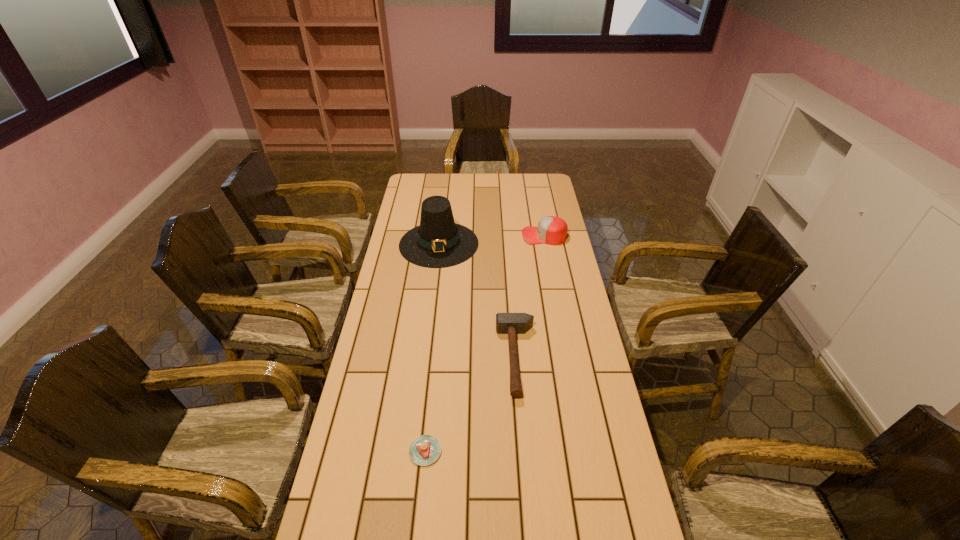
Identify the location of the tallest object. Image resolution: width=960 pixels, height=540 pixels. (438, 242).

Identify the location of baseball cap. The height and width of the screenshot is (540, 960). (552, 230).

At what (x,y) coordinates should I click in order to perform the action: click on the third farthest object. Please return your answer as a coordinate pair (x, y). This screenshot has height=540, width=960. Looking at the image, I should click on (506, 323).

This screenshot has width=960, height=540. Identify the location of the third tallest object. (506, 323).

You are a GUI agent. You are given a task and a screenshot of the screen. Output one action in this format:
    pyautogui.click(x=<x>, y=<y>)
    Task: Click on the shortest object
    Image resolution: width=960 pixels, height=540 pixels.
    Given the screenshot: What is the action you would take?
    pyautogui.click(x=424, y=450)

Identify the location of pastry. (424, 450).

Image resolution: width=960 pixels, height=540 pixels. In order to click on free space located 0.050m on the front-facing side of the tallest object in this screenshot , I will do `click(435, 276)`.

Where is `free space located 0.250m on the front-facing side of the second tallest object`? The image size is (960, 540). free space located 0.250m on the front-facing side of the second tallest object is located at coordinates (466, 235).

The width and height of the screenshot is (960, 540). Identify the location of vacant space situated 0.280m on the front-facing side of the second tallest object. (459, 235).

You are a GUI agent. You are given a task and a screenshot of the screen. Output one action in this format:
    pyautogui.click(x=<x>, y=<y>)
    Task: Click on the vacant space situated on the front-facing side of the second tallest object
    
    Given the screenshot: What is the action you would take?
    pyautogui.click(x=511, y=235)